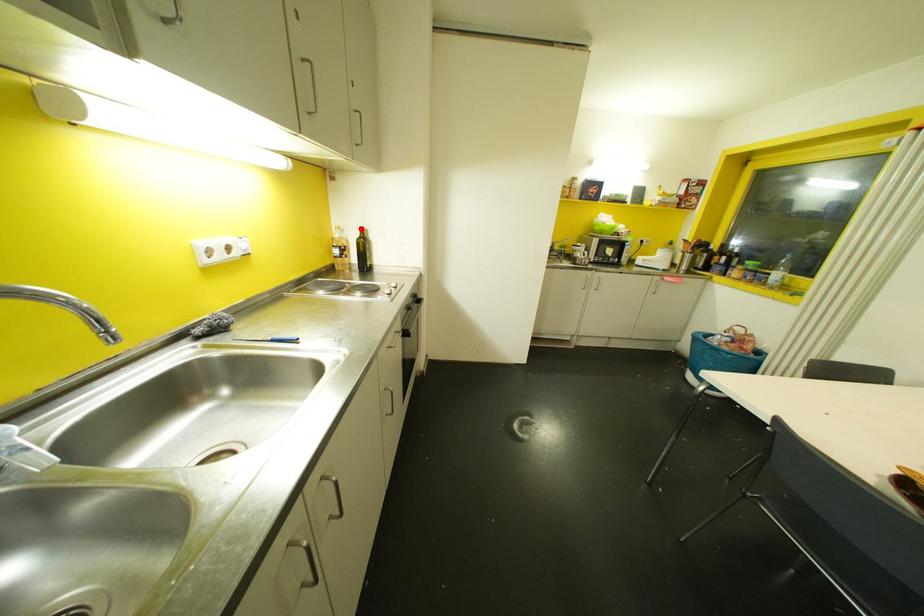
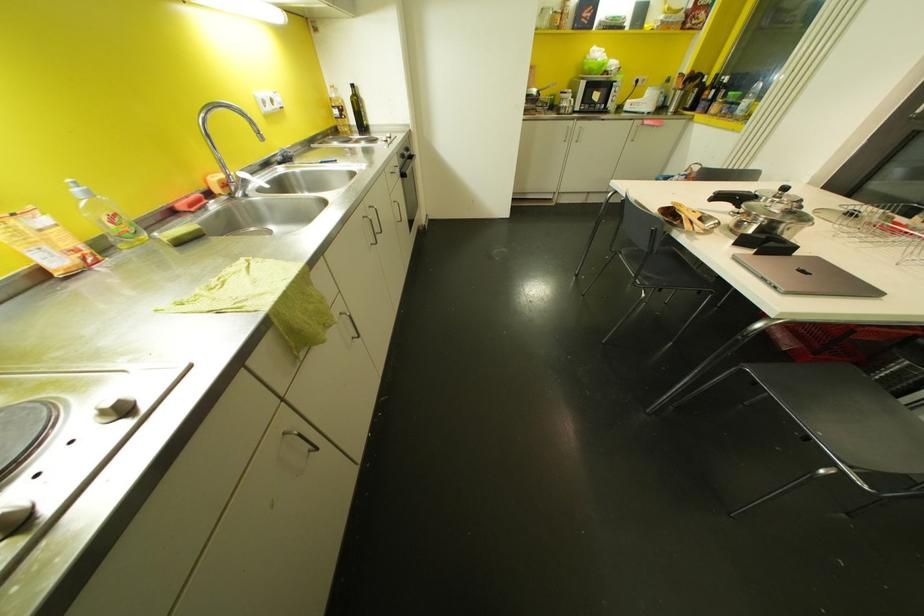
In the second image, find the point that corresponds to the highlighted location in the first image.

(353, 84)